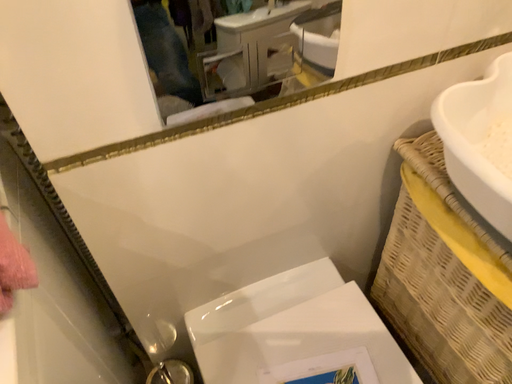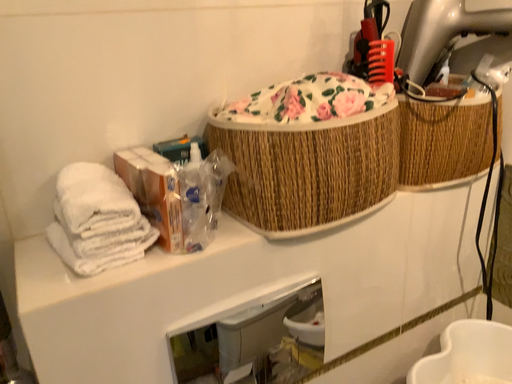
Question: How did the camera likely rotate when shooting the video?

Choices:
 (A) rotated downward
 (B) rotated upward

Answer: (B)